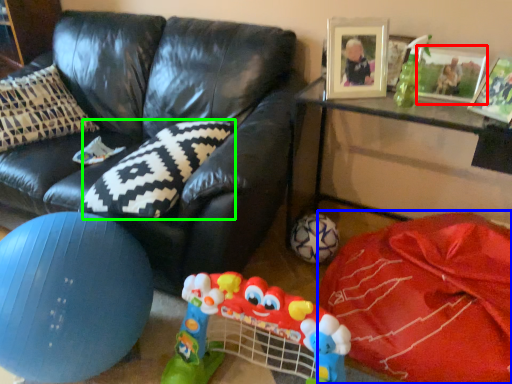
Question: Estimate the real-world distances between objects in this image. Which object is farther from picture frame (highlighted by a red box), material (highlighted by a blue box) or pillow (highlighted by a green box)?

Choices:
 (A) material
 (B) pillow

Answer: (B)